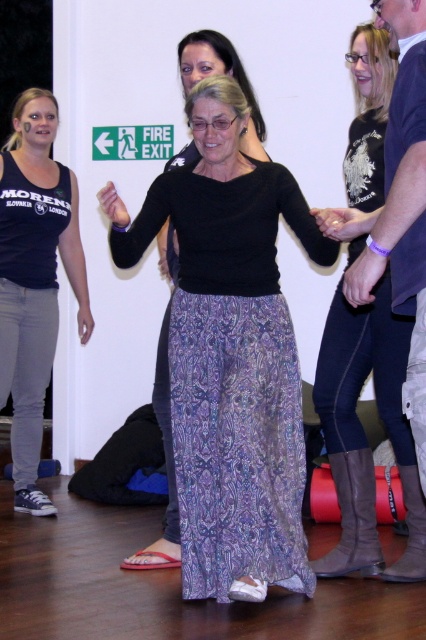
You are a photographer standing in the same room as the scene. You want to take a photo of both the matte black tank top at left and the purple printed skirt at center. Can you fit both in the frame of your camera which has a maximum focus range of 40 inches?

The matte black tank top at left is 39.24 inches away from the purple printed skirt at center. Since the distance between them is within the camera frame range of 40 inches, both can be captured in the same photo.

You are organizing a fashion show and need to ensure that all garments fit on a mannequin stand. The stand can only accommodate items up to the size of the matte black tank top at left. Will the patterned fabric skirt at center fit on the stand?

The patterned fabric skirt at center has a larger size compared to the matte black tank top at left, so it will not fit on the stand designed for the smaller size.